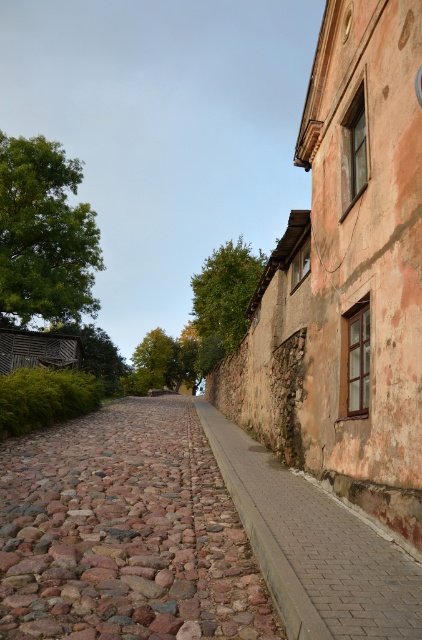
The height and width of the screenshot is (640, 422). What are the coordinates of `brown rough cobblestone at center` in the screenshot? It's located at (124, 532).

Who is higher up, brown rough cobblestone at center or brick pavement at lower right?

brick pavement at lower right is above.

Find the location of a particular element. This screenshot has height=640, width=422. brown rough cobblestone at center is located at coordinates (124, 532).